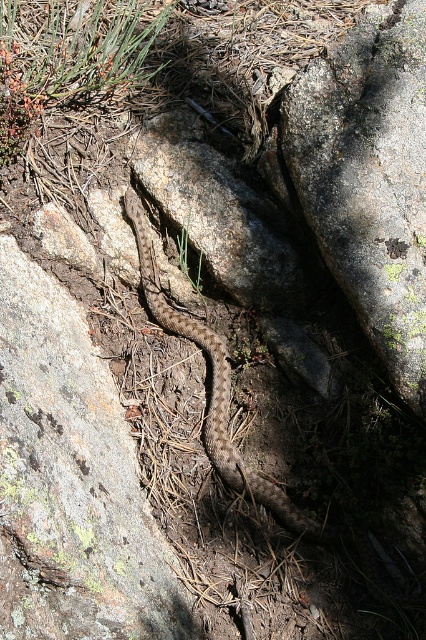
Who is positioned more to the right, speckled rock at center or brown/scaly snake at center?

brown/scaly snake at center is more to the right.

Can you confirm if speckled rock at center is positioned above brown/scaly snake at center?

Incorrect, speckled rock at center is not positioned above brown/scaly snake at center.

Measure the distance between point (152, 580) and camera.

They are 2.01 meters apart.

What are the coordinates of `speckled rock at center` in the screenshot? It's located at (71, 481).

From the picture: Does speckled gray rock at center have a smaller size compared to brown/scaly snake at center?

Correct, speckled gray rock at center occupies less space than brown/scaly snake at center.

The width and height of the screenshot is (426, 640). Describe the element at coordinates (368, 179) in the screenshot. I see `speckled gray rock at center` at that location.

Identify the location of speckled gray rock at center. (368, 179).

At what (x,y) coordinates should I click in order to perform the action: click on speckled gray rock at center. Please return your answer as a coordinate pair (x, y). This screenshot has width=426, height=640. Looking at the image, I should click on (368, 179).

This screenshot has height=640, width=426. What do you see at coordinates (71, 481) in the screenshot?
I see `speckled rock at center` at bounding box center [71, 481].

Does speckled rock at center appear over speckled gray rock at center?

No.

Between point (54, 625) and point (356, 257), which one is positioned behind?

Positioned behind is point (356, 257).

Find the location of a particular element. Image resolution: width=426 pixels, height=640 pixels. speckled rock at center is located at coordinates (71, 481).